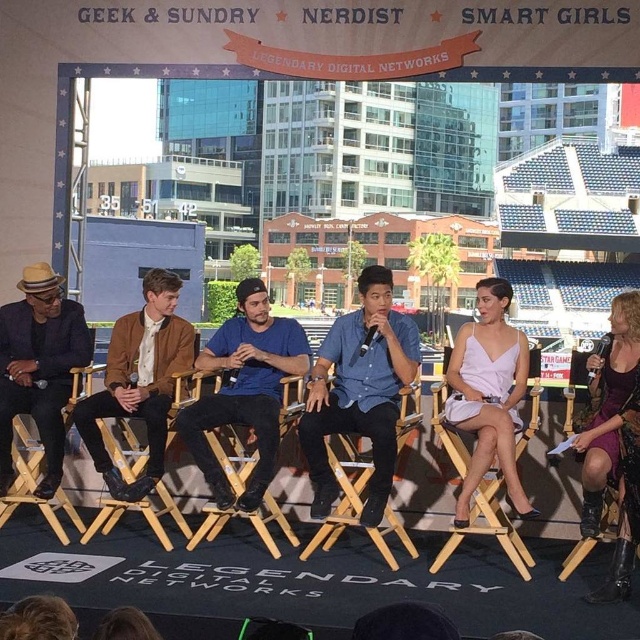
Question: Which point is closer to the camera?

Choices:
 (A) (12, 500)
 (B) (224, 410)

Answer: (B)

Question: Considering the real-world distances, which object is farthest from the blue denim shirt at center?

Choices:
 (A) brown leather jacket at center
 (B) blue cotton shirt at center
 (C) matte black suit at left
 (D) purple satin dress at lower right

Answer: (C)

Question: Is blue denim shirt at center to the left of purple satin dress at lower right from the viewer's perspective?

Choices:
 (A) yes
 (B) no

Answer: (A)

Question: Among these objects, which one is nearest to the camera?

Choices:
 (A) wooden folding chair at left
 (B) white satin dress at center
 (C) wooden chair at center

Answer: (B)

Question: Is white satin dress at center thinner than wooden chair at center?

Choices:
 (A) yes
 (B) no

Answer: (B)

Question: Is matte black suit at left positioned in front of purple satin dress at lower right?

Choices:
 (A) yes
 (B) no

Answer: (B)